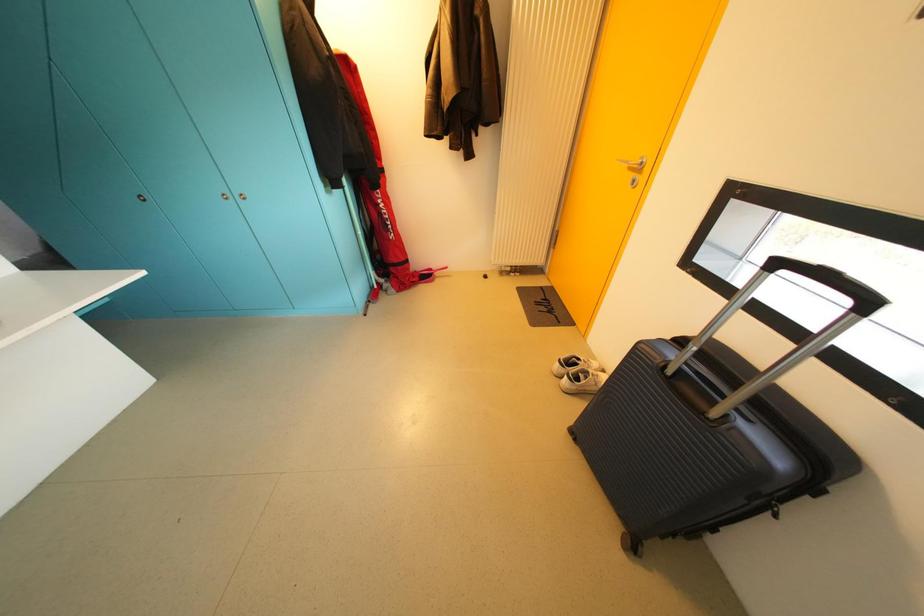
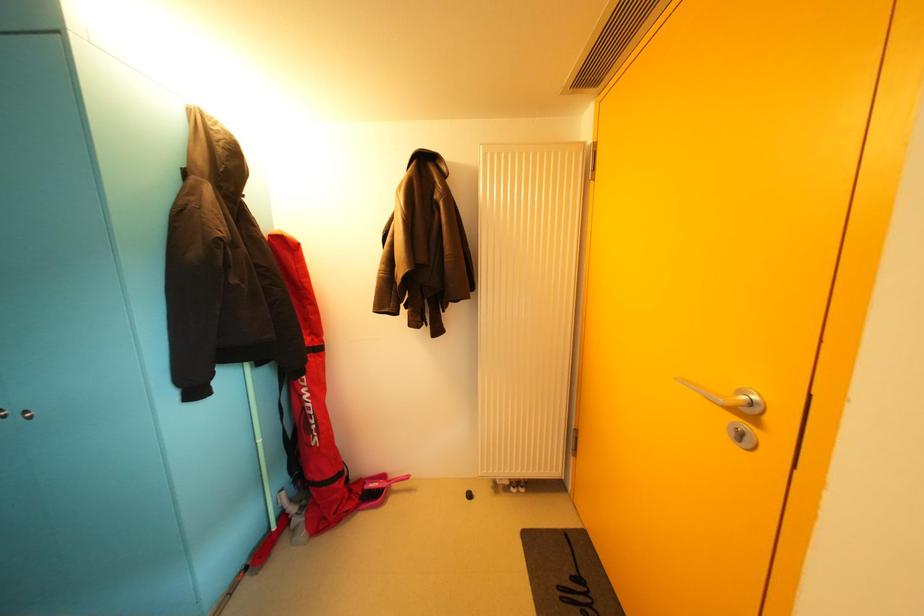
Which direction would the cameraman need to move to produce the second image?

The cameraman moved toward right, forward.